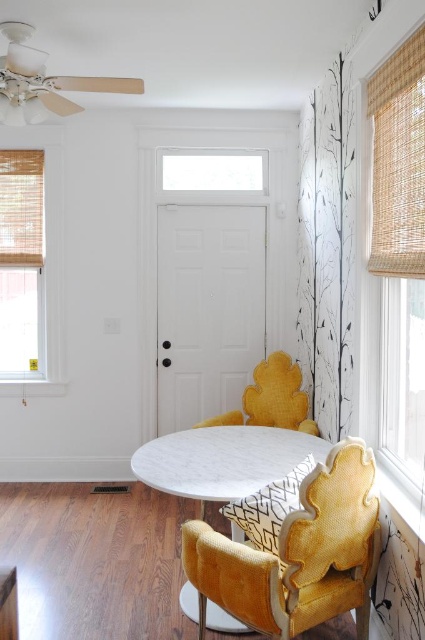
You are arranging a small party and need to place a 1.2 meter wide banner between the velvet yellow armchair at center and the woven bamboo shade at right. Can the banner fit horizontally between them?

The velvet yellow armchair at center is to the left of the woven bamboo shade at right, and the distance between them isn let you know, so it is uncertain whether the banner will fit. Please measure the space first.